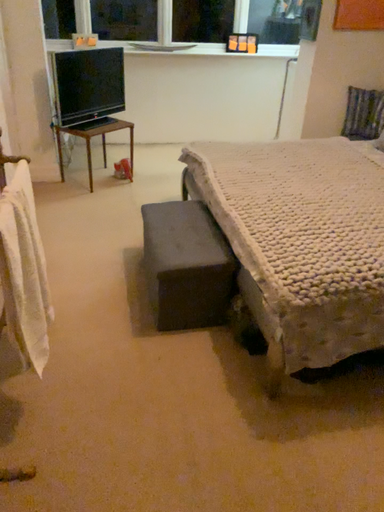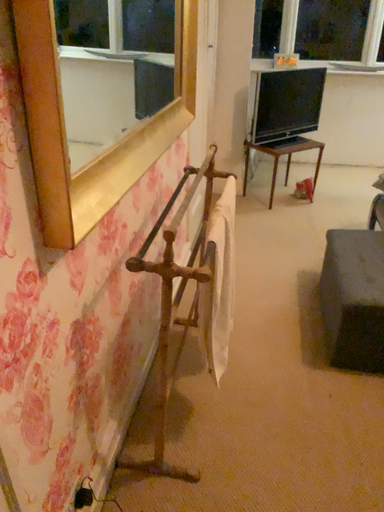
Question: How did the camera likely rotate when shooting the video?

Choices:
 (A) rotated left
 (B) rotated right

Answer: (A)